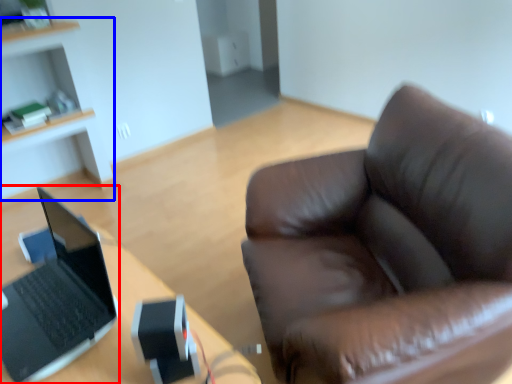
Question: Among these objects, which one is farthest to the camera, laptop (highlighted by a red box) or cabinetry (highlighted by a blue box)?

Choices:
 (A) laptop
 (B) cabinetry

Answer: (B)